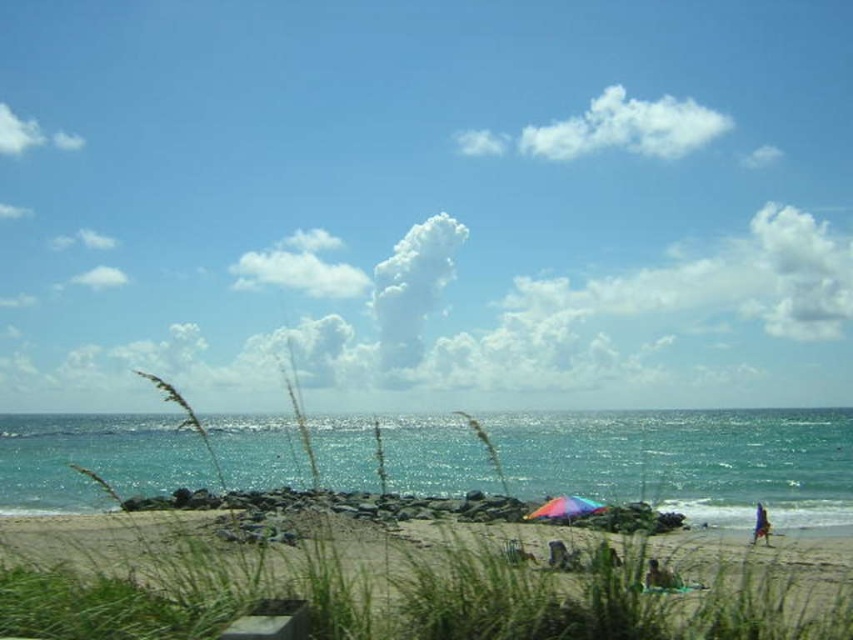
Question: Does glistening blue water at center appear under rainbow fabric umbrella at lower center?

Choices:
 (A) yes
 (B) no

Answer: (A)

Question: Is brown textured fabric at lower right positioned in front of blue fabric umbrella at lower right?

Choices:
 (A) yes
 (B) no

Answer: (A)

Question: Which object is closer to the camera taking this photo?

Choices:
 (A) brown textured fabric at lower right
 (B) glistening blue water at center
 (C) beige sandy beach at lower center

Answer: (C)

Question: From the image, what is the correct spatial relationship of beige sandy beach at lower center in relation to blue fabric umbrella at lower right?

Choices:
 (A) right
 (B) left

Answer: (B)

Question: Which of the following is the closest to the observer?

Choices:
 (A) blue fabric umbrella at lower right
 (B) beige sandy beach at lower center
 (C) brown textured fabric at lower right

Answer: (B)

Question: Which point is closer to the camera?

Choices:
 (A) brown textured fabric at lower right
 (B) glistening blue water at center
 (C) rainbow fabric umbrella at lower center
 (D) blue fabric umbrella at lower right

Answer: (A)